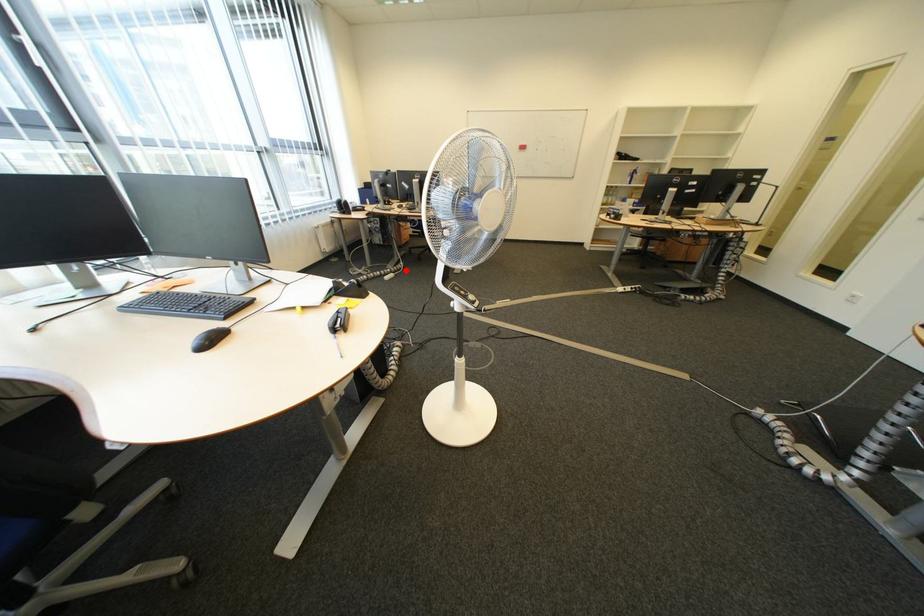
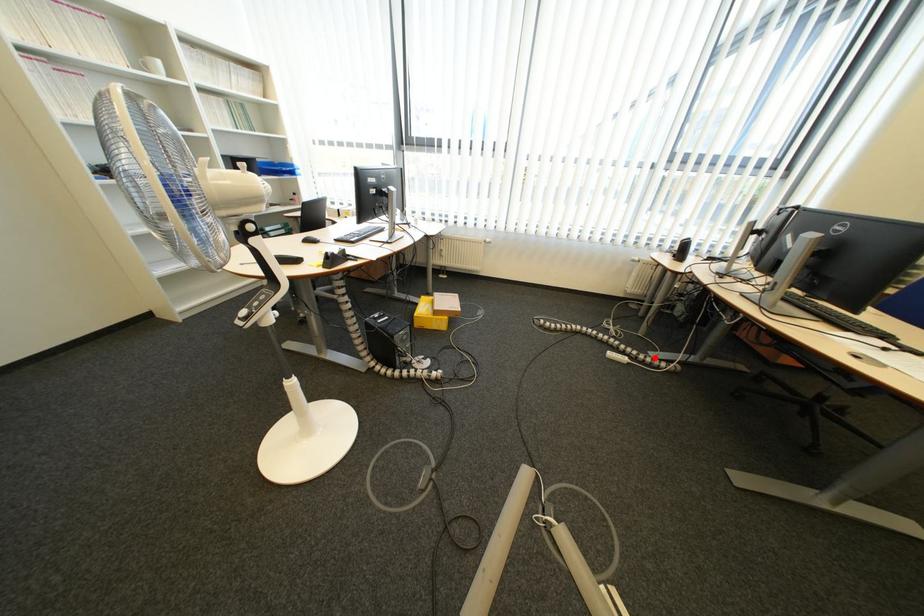
I am providing you with two images of the same scene from different viewpoints. A red point is marked on the first image and another point is marked on the second image. Does the point marked in image1 correspond to the same location as the one in image2?

Yes